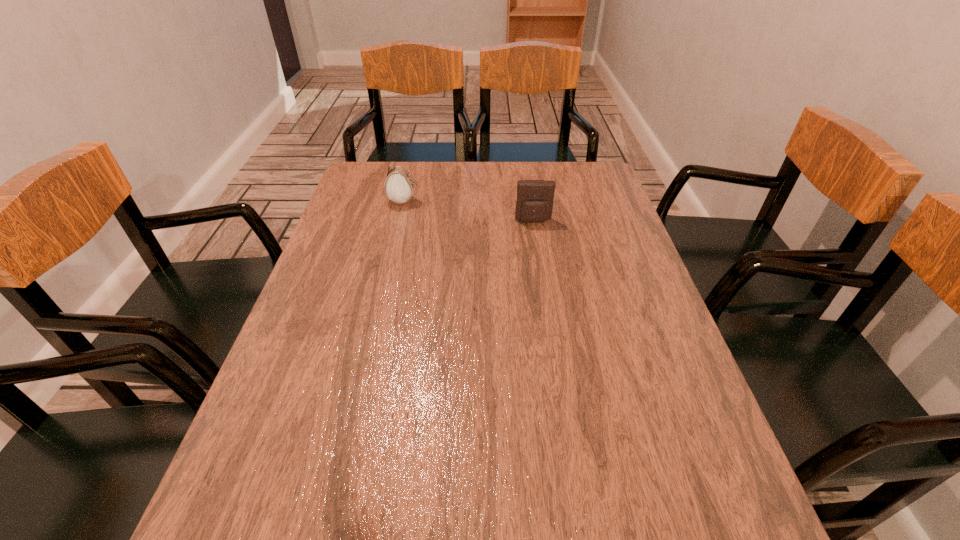
Find the location of a particular element. The image size is (960, 540). vacant space at the left edge of the desktop is located at coordinates (323, 410).

This screenshot has width=960, height=540. In the image, there is a desktop. Identify the location of free space at the right edge. (630, 394).

Image resolution: width=960 pixels, height=540 pixels. Find the location of `free region at the far left corner of the desktop`. free region at the far left corner of the desktop is located at coordinates (378, 191).

Where is `free location at the far right corner of the desktop`? free location at the far right corner of the desktop is located at coordinates (603, 193).

This screenshot has height=540, width=960. I want to click on vacant space that is in between the nearer pouch and the farthest object, so click(469, 211).

Locate an element on the screen. This screenshot has width=960, height=540. vacant point located between the farthest object and the nearer pouch is located at coordinates (469, 211).

At what (x,y) coordinates should I click in order to perform the action: click on unoccupied position between the nearer pouch and the farther pouch. Please return your answer as a coordinate pair (x, y). Image resolution: width=960 pixels, height=540 pixels. Looking at the image, I should click on pos(469,211).

Locate an element on the screen. This screenshot has height=540, width=960. vacant area that lies between the right pouch and the farther pouch is located at coordinates (469, 211).

Choose which object is the nearest neighbor to the left pouch. Please provide its 2D coordinates. Your answer should be formatted as a tuple, i.e. [(x, y)], where the tuple contains the x and y coordinates of a point satisfying the conditions above.

[(534, 204)]

Select which object is the second closest to the farther pouch. Please provide its 2D coordinates. Your answer should be formatted as a tuple, i.e. [(x, y)], where the tuple contains the x and y coordinates of a point satisfying the conditions above.

[(360, 539)]